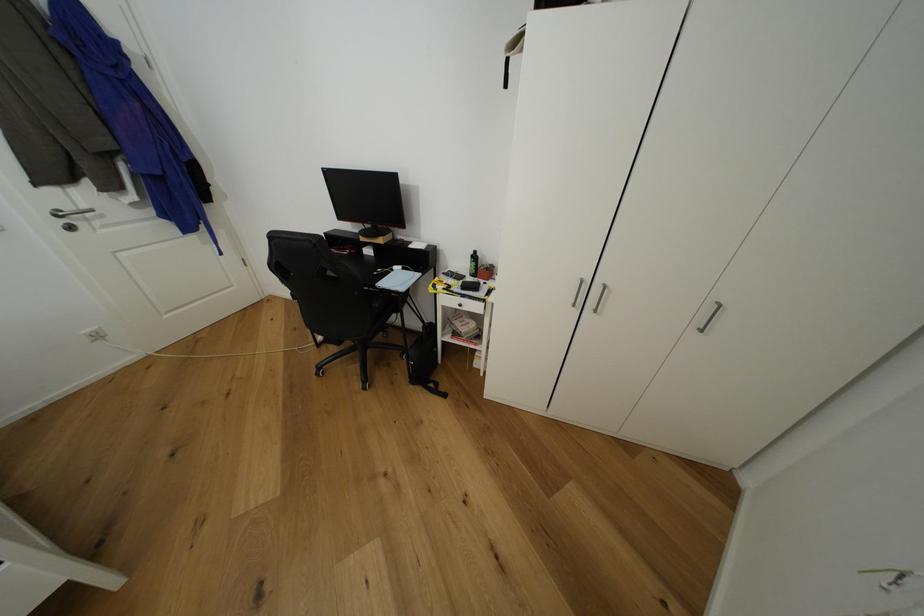
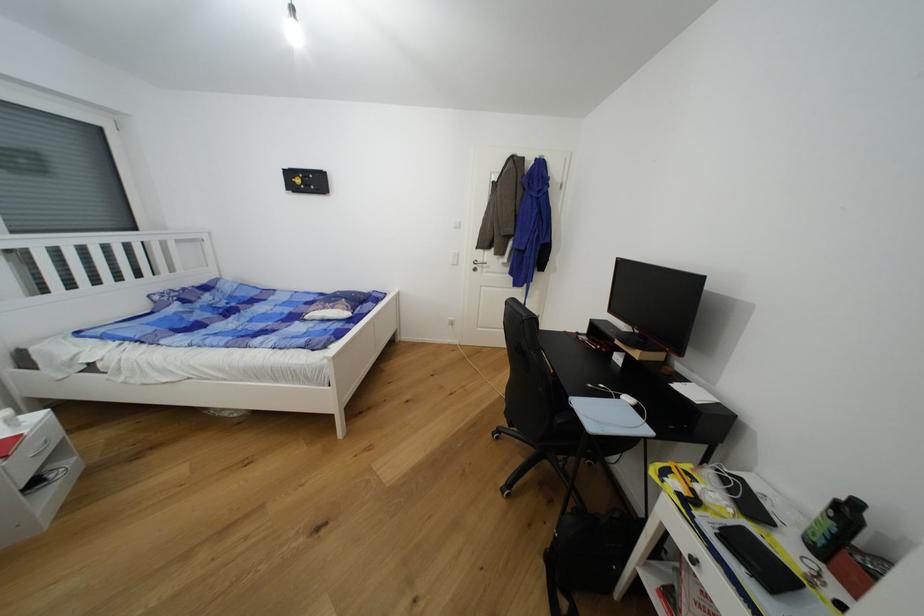
In the second image, find the point that corresponds to pixel 74 209 in the first image.

(484, 262)